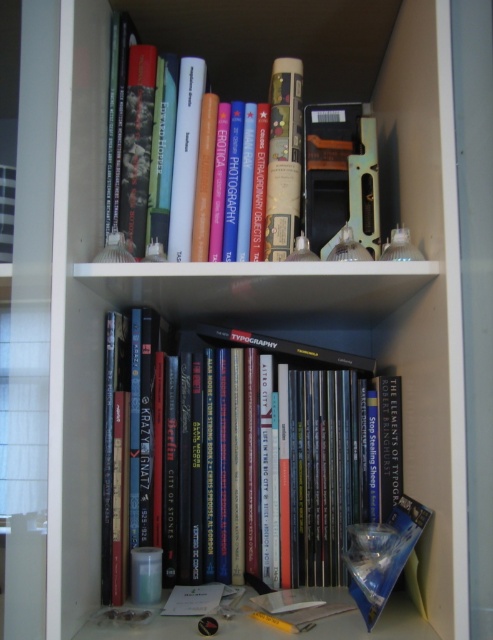
You are organizing books on a shelf and want to place a new book between the hardcover books at center and the hardcover book at upper center. Is there enough space between them to fit a standard 1.5 inch thick book?

The distance between the hardcover books at center and the hardcover book at upper center is 18.95 inches. Since the new book is only 1.5 inches thick, there is more than enough space to fit it between them.

You are organizing a bookshelf and notice the hardcover books at center and the hardcover book at upper center. Which one is placed below the other?

The hardcover books at center are positioned below the hardcover book at upper center.

You are organizing a bookshelf and need to place both the hardcover books at center and the hardcover book at upper center. Which one requires more space between the shelves?

The hardcover book at upper center requires more space between the shelves because it is thicker than the hardcover books at center.